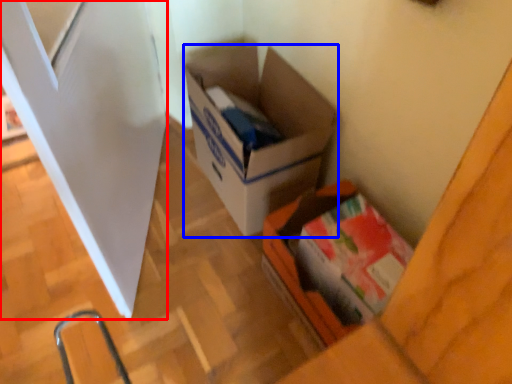
Question: Among these objects, which one is farthest to the camera, screen door (highlighted by a red box) or box (highlighted by a blue box)?

Choices:
 (A) screen door
 (B) box

Answer: (B)